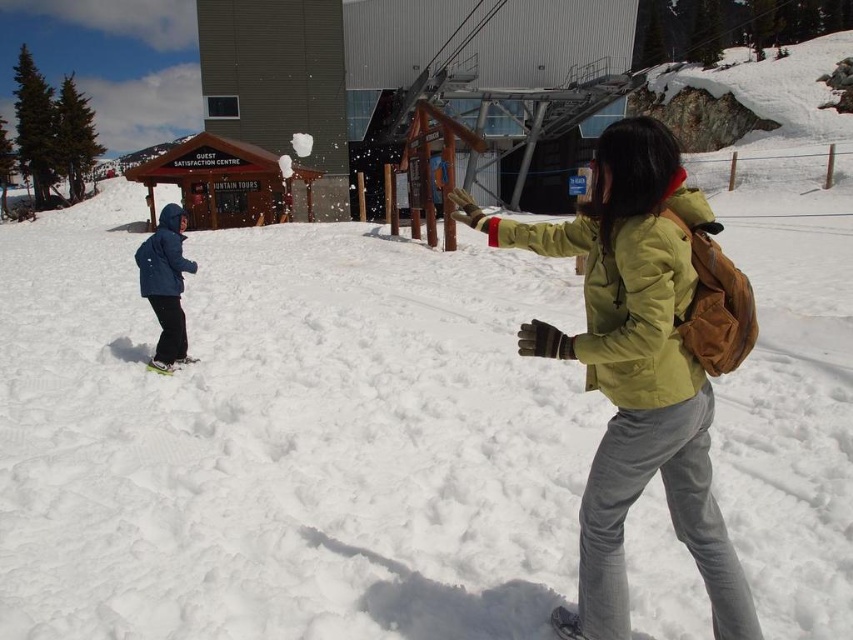
Measure the distance between green fuzzy jacket at center and dark blue fabric jacket at left.

The distance of green fuzzy jacket at center from dark blue fabric jacket at left is 5.80 meters.

Between point (660, 328) and point (175, 275), which one is positioned behind?

The point (175, 275) is more distant.

Is point (677, 336) behind point (184, 214)?

No, (677, 336) is in front of (184, 214).

Identify the location of green fuzzy jacket at center. The height and width of the screenshot is (640, 853). (622, 301).

Can you confirm if white snow at center is positioned to the right of green plastic snowboard at left?

Correct, you'll find white snow at center to the right of green plastic snowboard at left.

Does white snow at center appear under green plastic snowboard at left?

No.

Find the location of a particular element. This screenshot has height=640, width=853. white snow at center is located at coordinates (283, 436).

Who is positioned more to the left, white snow at center or green fuzzy jacket at center?

white snow at center is more to the left.

From the picture: Does white snow at center appear on the left side of green fuzzy jacket at center?

Correct, you'll find white snow at center to the left of green fuzzy jacket at center.

This screenshot has height=640, width=853. I want to click on white snow at center, so coord(283,436).